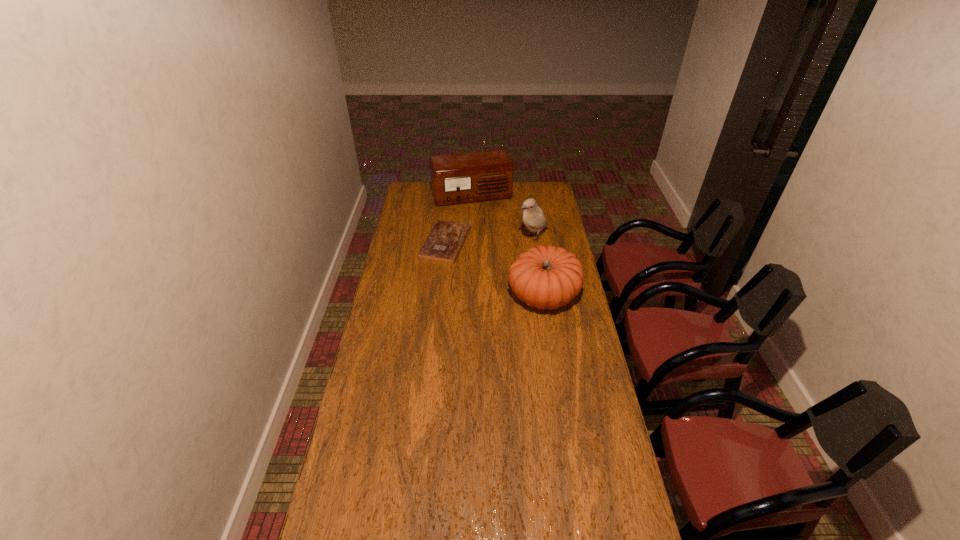
At what (x,y) coordinates should I click in order to perform the action: click on vacant spot on the desktop that is between the Bible and the nearest object and is positioned on the front-facing side of the radio receiver. Please return your answer as a coordinate pair (x, y). Looking at the image, I should click on (501, 273).

Locate an element on the screen. The height and width of the screenshot is (540, 960). free space on the desktop that is between the shortest object and the nearest object and is positioned at the beak of the bird is located at coordinates (490, 266).